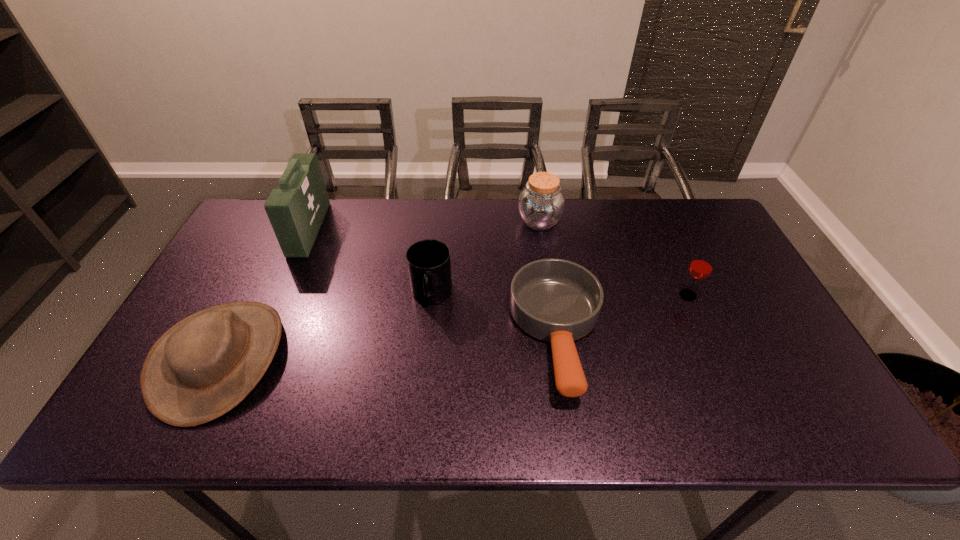
Locate an element on the screen. This screenshot has height=540, width=960. free space at the right edge of the desktop is located at coordinates (767, 378).

You are a GUI agent. You are given a task and a screenshot of the screen. Output one action in this format:
    pyautogui.click(x=<x>, y=<y>)
    Task: Click on the vacant space at the far left corner of the desktop
    This screenshot has width=960, height=540.
    Given the screenshot: What is the action you would take?
    pyautogui.click(x=237, y=243)

Where is `vacant area at the near left corner`? vacant area at the near left corner is located at coordinates (188, 432).

In the image, there is a desktop. Where is `vacant space at the near right corner`? vacant space at the near right corner is located at coordinates (775, 416).

Where is `free space between the mug and the jar`? free space between the mug and the jar is located at coordinates (486, 258).

This screenshot has width=960, height=540. Identify the location of empty location between the pan and the glass. (623, 315).

Find the location of `empty location between the glass and the cowboy hat`. empty location between the glass and the cowboy hat is located at coordinates (454, 327).

Where is `free space between the third object from left to right and the second shortest object`? This screenshot has width=960, height=540. free space between the third object from left to right and the second shortest object is located at coordinates (326, 327).

Where is `empty space between the third object from left to right and the cowboy hat`? empty space between the third object from left to right and the cowboy hat is located at coordinates (326, 327).

Locate an element on the screen. blank region between the pan and the second shortest object is located at coordinates point(389,347).